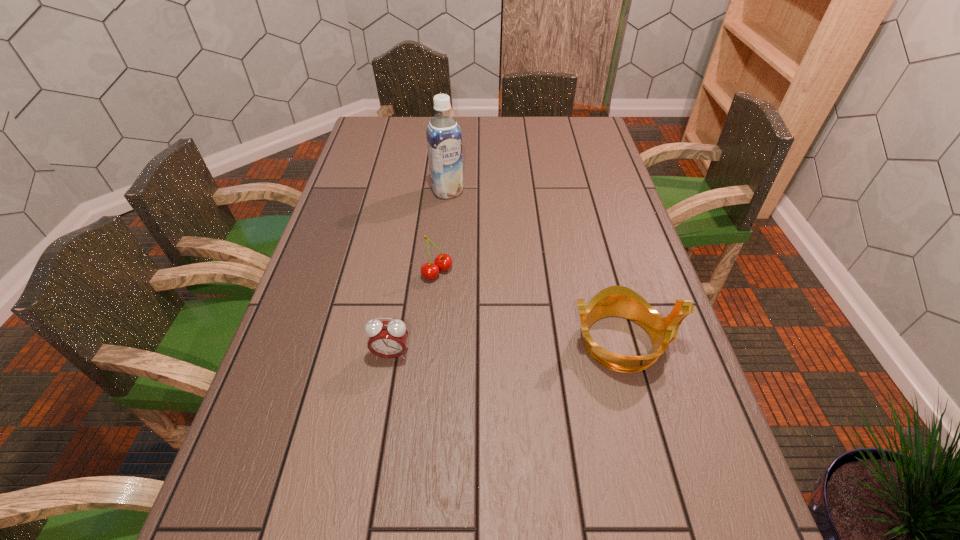
This screenshot has width=960, height=540. What are the coordinates of `vacant spot on the desktop that is between the alarm clock and the tiara and is positioned on the label of the farthest object` in the screenshot? It's located at (540, 346).

The image size is (960, 540). Identify the location of vacant space on the desktop that is between the alarm clock and the tiara and is positioned with the stems of the third nearest object pointing upwards. (539, 346).